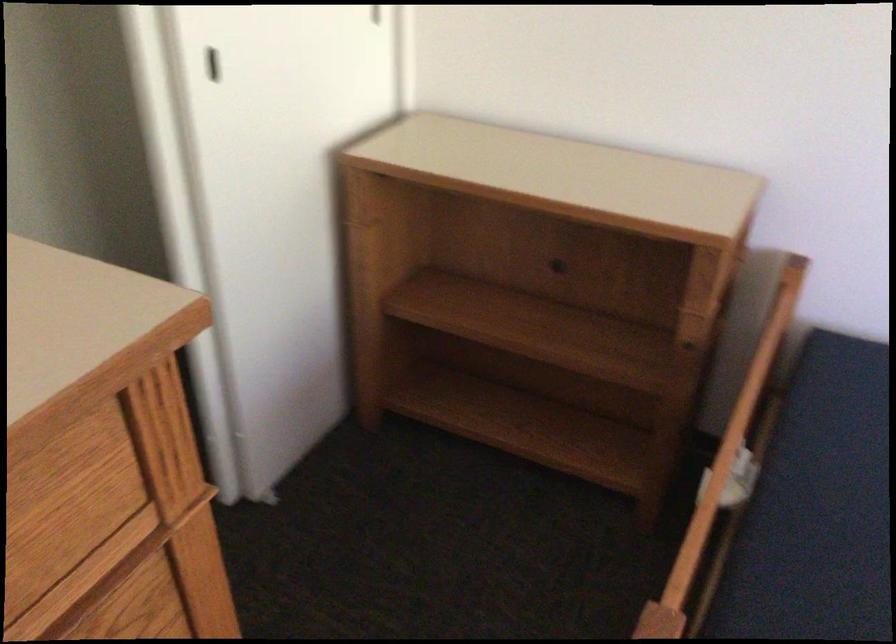
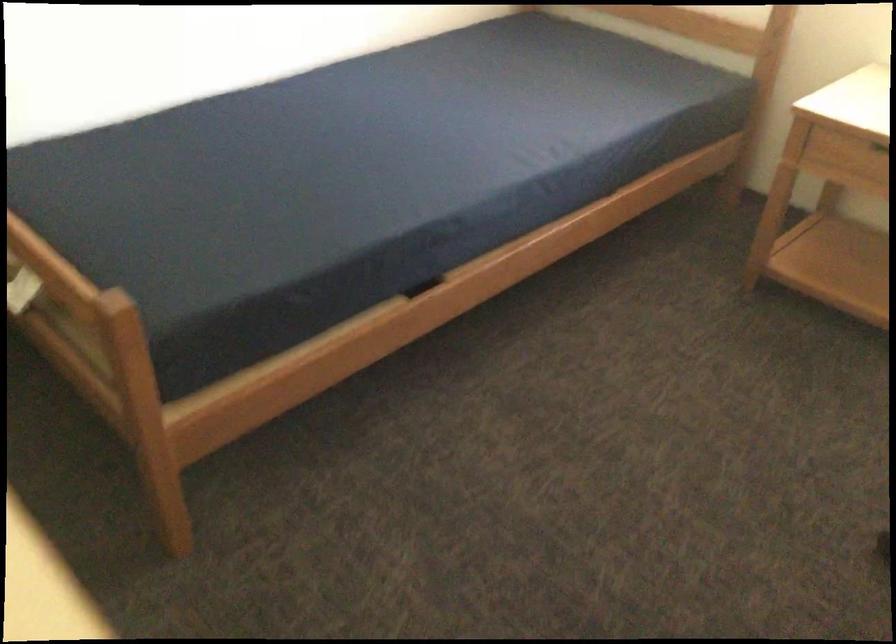
The images are taken continuously from a first-person perspective. In which direction is your viewpoint rotating?

The rotation direction of the camera is right-down.